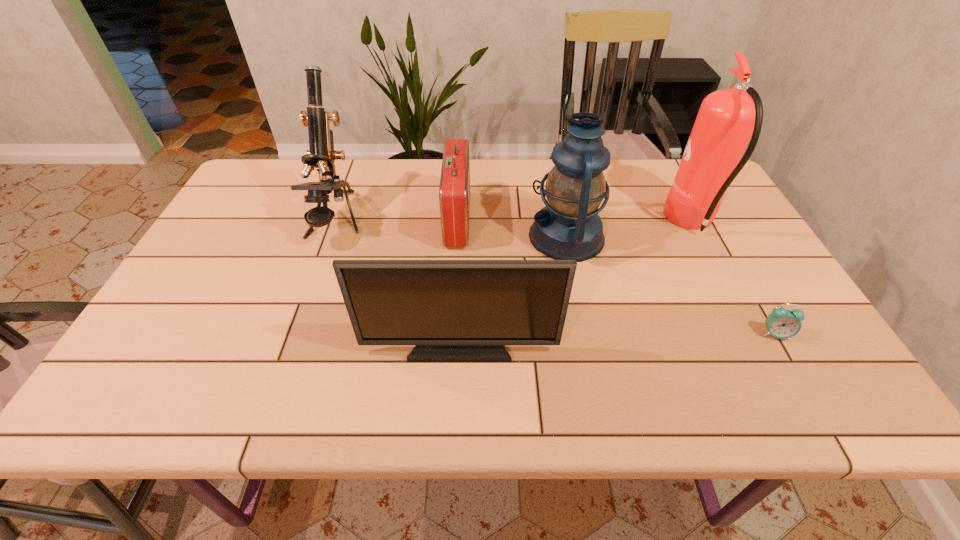
The width and height of the screenshot is (960, 540). I want to click on free space between the fifth tallest object and the shortest object, so click(616, 277).

This screenshot has height=540, width=960. What are the coordinates of `free space between the fifth tallest object and the leftmost object` in the screenshot? It's located at (397, 221).

Where is `the fourth closest object relative to the fifth tallest object`? the fourth closest object relative to the fifth tallest object is located at coordinates (727, 119).

Where is `the second closest object to the leftmost object`? Image resolution: width=960 pixels, height=540 pixels. the second closest object to the leftmost object is located at coordinates (453, 310).

Identify the location of free region that satisfies the following two spatial constraints: 1. on the face of the lantern; 2. on the screen side of the monitor. (588, 345).

At what (x,y) coordinates should I click in order to perform the action: click on vacant space that satisfies the following two spatial constraints: 1. towards the nozzle of the fire extinguisher; 2. on the screen side of the fourth tallest object. Please return your answer as a coordinate pair (x, y). This screenshot has width=960, height=540. Looking at the image, I should click on (756, 345).

Where is `free spot that satisfies the following two spatial constraints: 1. on the face of the lantern; 2. on the screen side of the third shortest object`? The image size is (960, 540). free spot that satisfies the following two spatial constraints: 1. on the face of the lantern; 2. on the screen side of the third shortest object is located at coordinates (588, 345).